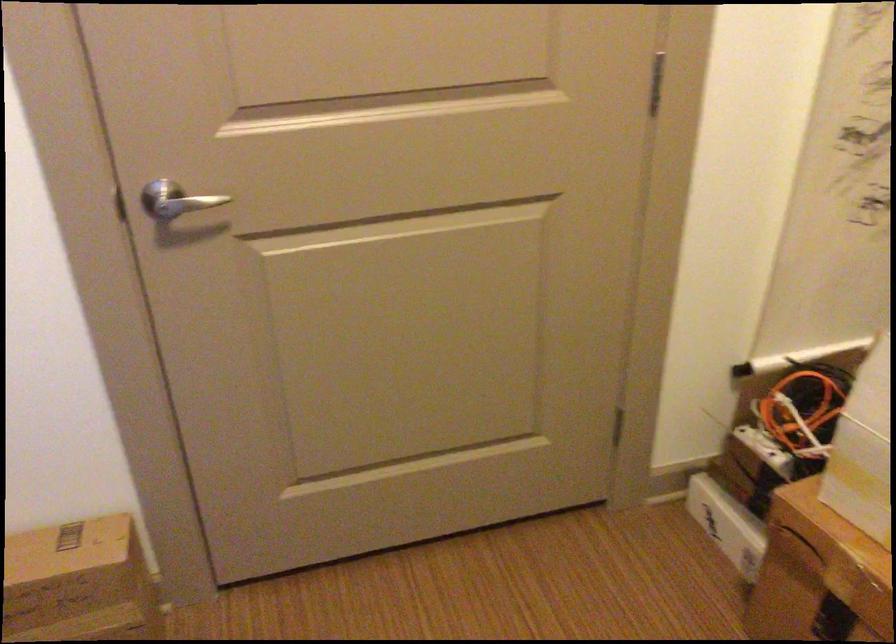
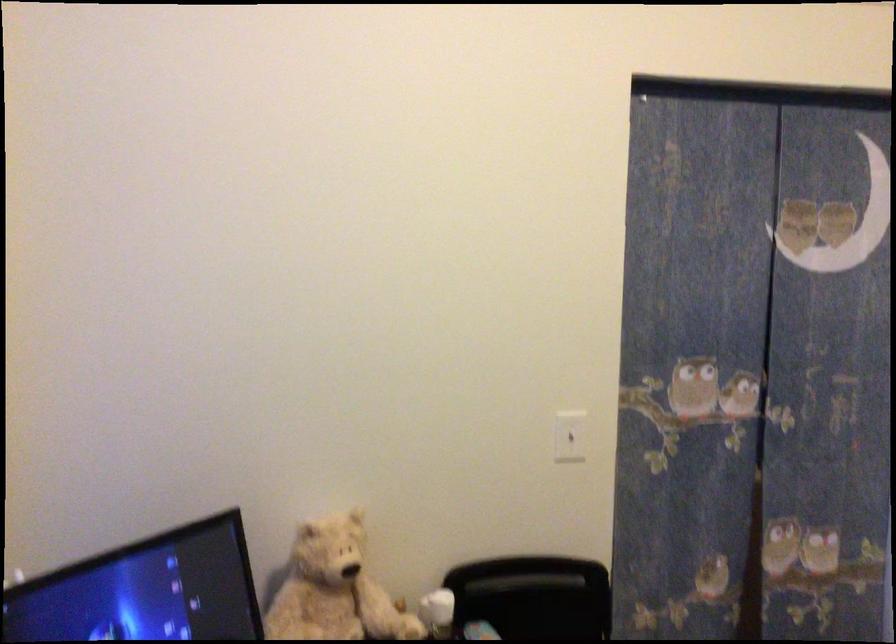
Question: The camera is either moving clockwise (left) or counter-clockwise (right) around the object. The first image is from the beginning of the video and the second image is from the end. Is the camera moving left or right when shooting the video?

Choices:
 (A) Left
 (B) Right

Answer: (B)